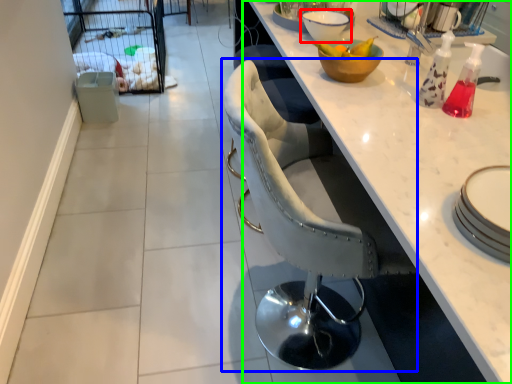
Question: Considering the real-world distances, which object is farthest from bowl (highlighted by a red box)? chair (highlighted by a blue box) or countertop (highlighted by a green box)?

Choices:
 (A) chair
 (B) countertop

Answer: (A)